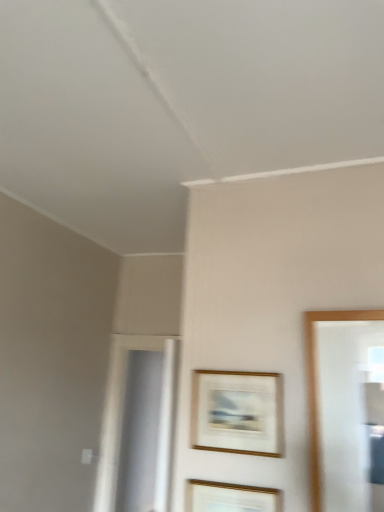
What is the approximate width of gold-framed picture at center, acting as the 2th picture frame starting from the top?

gold-framed picture at center, acting as the 2th picture frame starting from the top, is 1.18 inches in width.

This screenshot has width=384, height=512. What do you see at coordinates (229, 497) in the screenshot?
I see `gold-framed picture at center, which ranks as the 1th picture frame in bottom-to-top order` at bounding box center [229, 497].

What are the coordinates of `gold-framed picture at center, acting as the 2th picture frame starting from the top` in the screenshot? It's located at (229, 497).

This screenshot has height=512, width=384. I want to click on gold-framed artwork at center, which appears as the 2th picture frame when ordered from the bottom, so click(237, 412).

Describe the element at coordinates (237, 412) in the screenshot. This screenshot has width=384, height=512. I see `gold-framed artwork at center, which appears as the 2th picture frame when ordered from the bottom` at that location.

How much space does gold-framed artwork at center, which is the 1th picture frame from top to bottom, occupy horizontally?

gold-framed artwork at center, which is the 1th picture frame from top to bottom, is 2.52 centimeters wide.

Where is `gold-framed picture at center, acting as the 2th picture frame starting from the top`? This screenshot has width=384, height=512. gold-framed picture at center, acting as the 2th picture frame starting from the top is located at coordinates (229, 497).

From the picture: Considering the relative positions of gold-framed picture at center, which ranks as the 1th picture frame in bottom-to-top order, and gold-framed artwork at center, which is the 1th picture frame from top to bottom, in the image provided, is gold-framed picture at center, which ranks as the 1th picture frame in bottom-to-top order, to the left or to the right of gold-framed artwork at center, which is the 1th picture frame from top to bottom,?

From the image, it's evident that gold-framed picture at center, which ranks as the 1th picture frame in bottom-to-top order, is to the left of gold-framed artwork at center, which is the 1th picture frame from top to bottom.

Looking at this image, does gold-framed picture at center, acting as the 2th picture frame starting from the top, lie in front of gold-framed artwork at center, which is the 1th picture frame from top to bottom?

Yes, it is.

Which point is more forward, (221, 485) or (209, 421)?

Positioned in front is point (221, 485).

Looking at this image, from the image's perspective, is gold-framed picture at center, acting as the 2th picture frame starting from the top, located above gold-framed artwork at center, which is the 1th picture frame from top to bottom?

No, from the image's perspective, gold-framed picture at center, acting as the 2th picture frame starting from the top, is not on top of gold-framed artwork at center, which is the 1th picture frame from top to bottom.

From a real-world perspective, which object rests below the other?

In real-world perspective, gold-framed picture at center, which ranks as the 1th picture frame in bottom-to-top order, is lower.

Can you confirm if gold-framed picture at center, acting as the 2th picture frame starting from the top, is thinner than gold-framed artwork at center, which is the 1th picture frame from top to bottom?

Incorrect, the width of gold-framed picture at center, acting as the 2th picture frame starting from the top, is not less than that of gold-framed artwork at center, which is the 1th picture frame from top to bottom.

Who is shorter, gold-framed picture at center, which ranks as the 1th picture frame in bottom-to-top order, or gold-framed artwork at center, which is the 1th picture frame from top to bottom?

Standing shorter between the two is gold-framed artwork at center, which is the 1th picture frame from top to bottom.

Can you confirm if gold-framed picture at center, acting as the 2th picture frame starting from the top, is bigger than gold-framed artwork at center, which is the 1th picture frame from top to bottom?

Yes.

Do you think gold-framed picture at center, acting as the 2th picture frame starting from the top, is within gold-framed artwork at center, which appears as the 2th picture frame when ordered from the bottom, or outside of it?

gold-framed picture at center, acting as the 2th picture frame starting from the top, exists outside the volume of gold-framed artwork at center, which appears as the 2th picture frame when ordered from the bottom.

Is gold-framed picture at center, which ranks as the 1th picture frame in bottom-to-top order, far from gold-framed artwork at center, which is the 1th picture frame from top to bottom?

Actually, gold-framed picture at center, which ranks as the 1th picture frame in bottom-to-top order, and gold-framed artwork at center, which is the 1th picture frame from top to bottom, are a little close together.

Is gold-framed picture at center, acting as the 2th picture frame starting from the top, positioned with its back to gold-framed artwork at center, which is the 1th picture frame from top to bottom?

That's not correct — gold-framed picture at center, acting as the 2th picture frame starting from the top, is not looking away from gold-framed artwork at center, which is the 1th picture frame from top to bottom.

Locate an element on the screen. The height and width of the screenshot is (512, 384). picture frame directly beneath the gold-framed artwork at center, which appears as the 2th picture frame when ordered from the bottom (from a real-world perspective) is located at coordinates (229, 497).

Considering the relative positions of gold-framed artwork at center, which is the 1th picture frame from top to bottom, and gold-framed picture at center, which ranks as the 1th picture frame in bottom-to-top order, in the image provided, is gold-framed artwork at center, which is the 1th picture frame from top to bottom, to the right of gold-framed picture at center, which ranks as the 1th picture frame in bottom-to-top order, from the viewer's perspective?

Yes, gold-framed artwork at center, which is the 1th picture frame from top to bottom, is to the right of gold-framed picture at center, which ranks as the 1th picture frame in bottom-to-top order.

Is gold-framed artwork at center, which appears as the 2th picture frame when ordered from the bottom, further to the viewer compared to gold-framed picture at center, which ranks as the 1th picture frame in bottom-to-top order?

Yes, gold-framed artwork at center, which appears as the 2th picture frame when ordered from the bottom, is behind gold-framed picture at center, which ranks as the 1th picture frame in bottom-to-top order.

Is point (252, 408) closer or farther from the camera than point (192, 485)?

Clearly, point (252, 408) is more distant from the camera than point (192, 485).

Consider the image. From the image's perspective, is gold-framed artwork at center, which is the 1th picture frame from top to bottom, above or below gold-framed picture at center, acting as the 2th picture frame starting from the top?

gold-framed artwork at center, which is the 1th picture frame from top to bottom, is situated higher than gold-framed picture at center, acting as the 2th picture frame starting from the top, in the image.

From a real-world perspective, relative to gold-framed picture at center, which ranks as the 1th picture frame in bottom-to-top order, is gold-framed artwork at center, which appears as the 2th picture frame when ordered from the bottom, vertically above or below?

gold-framed artwork at center, which appears as the 2th picture frame when ordered from the bottom, is situated higher than gold-framed picture at center, which ranks as the 1th picture frame in bottom-to-top order, in the real world.

Can you confirm if gold-framed artwork at center, which appears as the 2th picture frame when ordered from the bottom, is wider than gold-framed picture at center, which ranks as the 1th picture frame in bottom-to-top order?

Incorrect, the width of gold-framed artwork at center, which appears as the 2th picture frame when ordered from the bottom, does not surpass that of gold-framed picture at center, which ranks as the 1th picture frame in bottom-to-top order.

Is gold-framed artwork at center, which is the 1th picture frame from top to bottom, taller than gold-framed picture at center, which ranks as the 1th picture frame in bottom-to-top order?

No.

Considering the relative sizes of gold-framed artwork at center, which is the 1th picture frame from top to bottom, and gold-framed picture at center, which ranks as the 1th picture frame in bottom-to-top order, in the image provided, is gold-framed artwork at center, which is the 1th picture frame from top to bottom, bigger than gold-framed picture at center, which ranks as the 1th picture frame in bottom-to-top order,?

No, gold-framed artwork at center, which is the 1th picture frame from top to bottom, is not bigger than gold-framed picture at center, which ranks as the 1th picture frame in bottom-to-top order.

Is gold-framed artwork at center, which appears as the 2th picture frame when ordered from the bottom, not within gold-framed picture at center, which ranks as the 1th picture frame in bottom-to-top order?

Indeed, gold-framed artwork at center, which appears as the 2th picture frame when ordered from the bottom, is completely outside gold-framed picture at center, which ranks as the 1th picture frame in bottom-to-top order.

Are gold-framed artwork at center, which is the 1th picture frame from top to bottom, and gold-framed picture at center, which ranks as the 1th picture frame in bottom-to-top order, making contact?

They are not placed beside each other.

Could you tell me if gold-framed artwork at center, which is the 1th picture frame from top to bottom, is facing gold-framed picture at center, which ranks as the 1th picture frame in bottom-to-top order?

No, gold-framed artwork at center, which is the 1th picture frame from top to bottom, is not turned towards gold-framed picture at center, which ranks as the 1th picture frame in bottom-to-top order.

Can you tell me how much gold-framed artwork at center, which appears as the 2th picture frame when ordered from the bottom, and gold-framed picture at center, acting as the 2th picture frame starting from the top, differ in facing direction?

The angle between the facing direction of gold-framed artwork at center, which appears as the 2th picture frame when ordered from the bottom, and the facing direction of gold-framed picture at center, acting as the 2th picture frame starting from the top, is 0.0135 degrees.

How much distance is there between gold-framed artwork at center, which is the 1th picture frame from top to bottom, and gold-framed picture at center, acting as the 2th picture frame starting from the top?

gold-framed artwork at center, which is the 1th picture frame from top to bottom, and gold-framed picture at center, acting as the 2th picture frame starting from the top, are 8.43 inches apart.

Locate an element on the screen. picture frame below the gold-framed artwork at center, which appears as the 2th picture frame when ordered from the bottom (from the image's perspective) is located at coordinates (229, 497).

You are a GUI agent. You are given a task and a screenshot of the screen. Output one action in this format:
    pyautogui.click(x=<x>, y=<y>)
    Task: Click on the picture frame in front of the gold-framed artwork at center, which appears as the 2th picture frame when ordered from the bottom
    The height and width of the screenshot is (512, 384).
    Given the screenshot: What is the action you would take?
    pyautogui.click(x=229, y=497)

Identify the location of picture frame above the gold-framed picture at center, which ranks as the 1th picture frame in bottom-to-top order (from a real-world perspective). This screenshot has width=384, height=512. (237, 412).